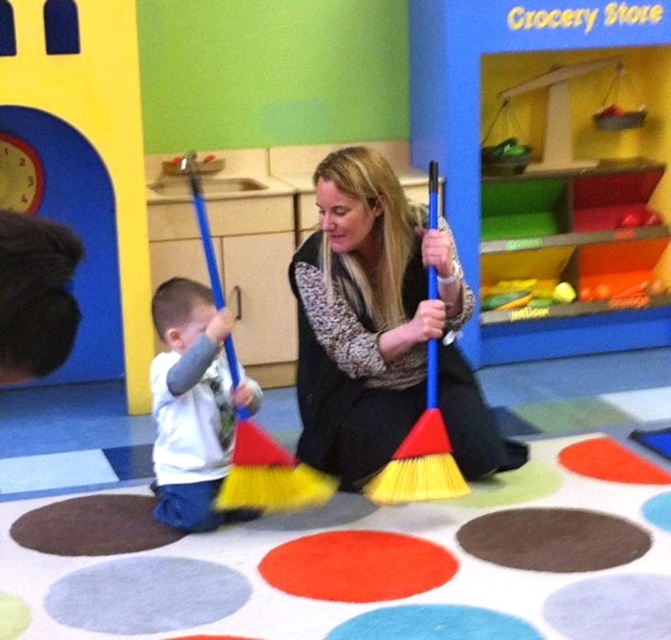
Question: Which of the following is the closest to the observer?

Choices:
 (A) (x=419, y=209)
 (B) (x=435, y=298)

Answer: (B)

Question: Is white soft shirt at lower left above yellow-bristled broom at center?

Choices:
 (A) yes
 (B) no

Answer: (B)

Question: Is white soft shirt at lower left further to camera compared to yellow-bristled broom at center?

Choices:
 (A) no
 (B) yes

Answer: (B)

Question: Which of the following is the farthest from the observer?

Choices:
 (A) (437, 493)
 (B) (160, 292)
 (C) (374, 285)

Answer: (C)

Question: Estimate the real-world distances between objects in this image. Which object is closer to the yellow-bristled broom at center?

Choices:
 (A) matte blue broom at center
 (B) white soft shirt at lower left

Answer: (A)

Question: Does matte blue broom at center lie behind white soft shirt at lower left?

Choices:
 (A) no
 (B) yes

Answer: (B)